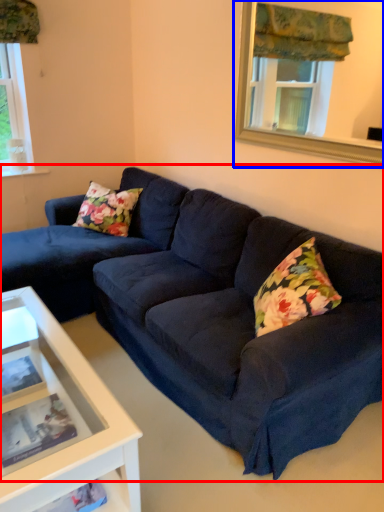
Question: Among these objects, which one is farthest to the camera, studio couch (highlighted by a red box) or window frame (highlighted by a blue box)?

Choices:
 (A) studio couch
 (B) window frame

Answer: (B)